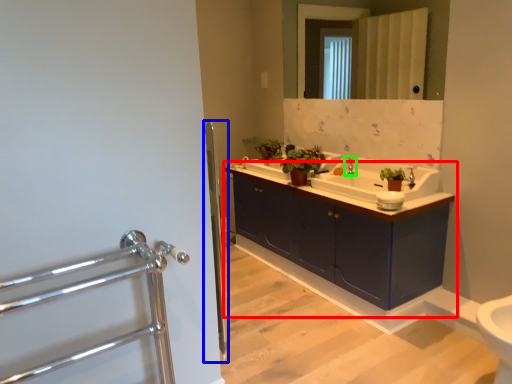
Question: Estimate the real-world distances between objects in this image. Which object is closer to bathroom cabinet (highlighted by a red box), screen door (highlighted by a blue box) or tap (highlighted by a green box)?

Choices:
 (A) screen door
 (B) tap

Answer: (B)